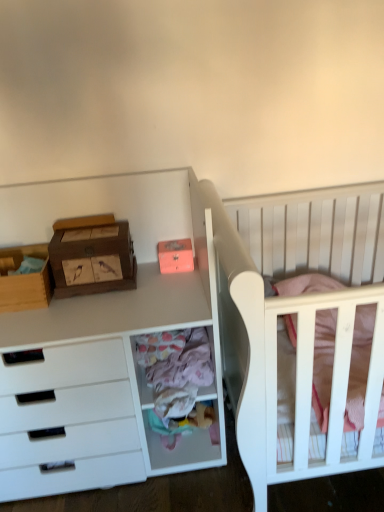
Describe the element at coordinates (103, 342) in the screenshot. I see `wooden chest of drawers at left` at that location.

Image resolution: width=384 pixels, height=512 pixels. What do you see at coordinates (182, 436) in the screenshot? I see `pastel fabric drawer at center` at bounding box center [182, 436].

Find the location of `matte orange storage box at upper center, which appears as the second storage box when viewed from the left`. matte orange storage box at upper center, which appears as the second storage box when viewed from the left is located at coordinates (x=175, y=256).

Identify the location of wooden chest of drawers at left. (103, 342).

From the picture: Is wooden chest of drawers at left shorter than matte orange storage box at upper center, the 1th storage box viewed from the right?

No.

From the image's perspective, is wooden chest of drawers at left beneath matte orange storage box at upper center, the 1th storage box viewed from the right?

Yes.

From a real-world perspective, is wooden chest of drawers at left on matte orange storage box at upper center, the 1th storage box viewed from the right?

Actually, wooden chest of drawers at left is physically below matte orange storage box at upper center, the 1th storage box viewed from the right, in the real world.

Considering the sizes of white wood crib at right and wooden storage box at left, acting as the 2th storage box starting from the right, in the image, is white wood crib at right taller or shorter than wooden storage box at left, acting as the 2th storage box starting from the right,?

Clearly, white wood crib at right is taller compared to wooden storage box at left, acting as the 2th storage box starting from the right.

Based on the photo, is white wood crib at right turned away from wooden storage box at left, arranged as the 1th storage box when viewed from the left?

No, white wood crib at right is not facing the opposite direction of wooden storage box at left, arranged as the 1th storage box when viewed from the left.

Consider the image. From the image's perspective, is white wood crib at right above or below wooden storage box at left, acting as the 2th storage box starting from the right?

Clearly, from the image's perspective, white wood crib at right is below wooden storage box at left, acting as the 2th storage box starting from the right.

Is point (3, 277) positioned behind point (128, 366)?

Yes, point (3, 277) is behind point (128, 366).

From the image's perspective, which one is positioned higher, wooden storage box at left, arranged as the 1th storage box when viewed from the left, or wooden chest of drawers at left?

wooden storage box at left, arranged as the 1th storage box when viewed from the left, is shown above in the image.

Choose the correct answer: Is wooden storage box at left, acting as the 2th storage box starting from the right, inside wooden chest of drawers at left or outside it?

wooden storage box at left, acting as the 2th storage box starting from the right, exists entirely within wooden chest of drawers at left.

Does pastel fabric drawer at center have a lesser height compared to wooden with bird designs at left?

In fact, pastel fabric drawer at center may be taller than wooden with bird designs at left.

Choose the correct answer: Is pastel fabric drawer at center inside wooden with bird designs at left or outside it?

The correct answer is: outside.

You are a GUI agent. You are given a task and a screenshot of the screen. Output one action in this format:
    pyautogui.click(x=<x>, y=<y>)
    Task: Click on the shoe box lying on the left of pastel fabric drawer at center
    Image resolution: width=384 pixels, height=512 pixels.
    Given the screenshot: What is the action you would take?
    pyautogui.click(x=92, y=256)

From the image's perspective, is pastel fabric drawer at center on wooden with bird designs at left?

No, from the image's perspective, pastel fabric drawer at center is not above wooden with bird designs at left.

Which is more to the left, matte orange storage box at upper center, which appears as the second storage box when viewed from the left, or wooden storage box at left, arranged as the 1th storage box when viewed from the left?

wooden storage box at left, arranged as the 1th storage box when viewed from the left, is more to the left.

Can you confirm if matte orange storage box at upper center, which appears as the second storage box when viewed from the left, is shorter than wooden storage box at left, acting as the 2th storage box starting from the right?

Correct, matte orange storage box at upper center, which appears as the second storage box when viewed from the left, is not as tall as wooden storage box at left, acting as the 2th storage box starting from the right.

Looking at their sizes, would you say matte orange storage box at upper center, which appears as the second storage box when viewed from the left, is wider or thinner than wooden storage box at left, acting as the 2th storage box starting from the right?

In the image, matte orange storage box at upper center, which appears as the second storage box when viewed from the left, appears to be more narrow than wooden storage box at left, acting as the 2th storage box starting from the right.

Between matte orange storage box at upper center, the 1th storage box viewed from the right, and wooden storage box at left, acting as the 2th storage box starting from the right, which one has larger size?

wooden storage box at left, acting as the 2th storage box starting from the right, is bigger.

Considering the relative sizes of wooden storage box at left, arranged as the 1th storage box when viewed from the left, and matte orange storage box at upper center, which appears as the second storage box when viewed from the left, in the image provided, is wooden storage box at left, arranged as the 1th storage box when viewed from the left, wider than matte orange storage box at upper center, which appears as the second storage box when viewed from the left,?

Indeed, wooden storage box at left, arranged as the 1th storage box when viewed from the left, has a greater width compared to matte orange storage box at upper center, which appears as the second storage box when viewed from the left.

Is wooden storage box at left, arranged as the 1th storage box when viewed from the left, far from matte orange storage box at upper center, which appears as the second storage box when viewed from the left?

They are positioned close to each other.

Can you confirm if wooden storage box at left, arranged as the 1th storage box when viewed from the left, is taller than matte orange storage box at upper center, the 1th storage box viewed from the right?

Indeed, wooden storage box at left, arranged as the 1th storage box when viewed from the left, has a greater height compared to matte orange storage box at upper center, the 1th storage box viewed from the right.

Considering the sizes of objects wooden storage box at left, acting as the 2th storage box starting from the right, and matte orange storage box at upper center, the 1th storage box viewed from the right, in the image provided, who is bigger, wooden storage box at left, acting as the 2th storage box starting from the right, or matte orange storage box at upper center, the 1th storage box viewed from the right,?

Bigger between the two is wooden storage box at left, acting as the 2th storage box starting from the right.

Does matte orange storage box at upper center, the 1th storage box viewed from the right, have a lesser width compared to pastel fabric drawer at center?

Yes.

From a real-world perspective, is matte orange storage box at upper center, which appears as the second storage box when viewed from the left, above or below pastel fabric drawer at center?

From a real-world perspective, matte orange storage box at upper center, which appears as the second storage box when viewed from the left, is physically above pastel fabric drawer at center.

Is the position of matte orange storage box at upper center, the 1th storage box viewed from the right, less distant than that of pastel fabric drawer at center?

No, the depth of matte orange storage box at upper center, the 1th storage box viewed from the right, is greater than that of pastel fabric drawer at center.

Identify the location of chest of drawers below the matte orange storage box at upper center, which appears as the second storage box when viewed from the left (from the image's perspective). The width and height of the screenshot is (384, 512). (103, 342).

Which storage box is the 1st one when counting from the back of the white wood crib at right? Please provide its 2D coordinates.

[(24, 280)]

Considering their positions, is white wood crib at right positioned closer to matte orange storage box at upper center, the 1th storage box viewed from the right, than wooden storage box at left, arranged as the 1th storage box when viewed from the left?

wooden storage box at left, arranged as the 1th storage box when viewed from the left, is positioned closer to the anchor matte orange storage box at upper center, the 1th storage box viewed from the right.

Considering their positions, is white wood crib at right positioned closer to matte orange storage box at upper center, which appears as the second storage box when viewed from the left, than pastel fabric drawer at center?

pastel fabric drawer at center is positioned closer to the anchor matte orange storage box at upper center, which appears as the second storage box when viewed from the left.

Looking at the image, which one is located closer to wooden chest of drawers at left, wooden with bird designs at left or matte orange storage box at upper center, which appears as the second storage box when viewed from the left?

wooden with bird designs at left is closer to wooden chest of drawers at left.

Estimate the real-world distances between objects in this image. Which object is further from pastel fabric drawer at center, wooden with bird designs at left or wooden chest of drawers at left?

wooden with bird designs at left lies further to pastel fabric drawer at center than the other object.

From the image, which object appears to be nearer to white wood crib at right, wooden storage box at left, arranged as the 1th storage box when viewed from the left, or matte orange storage box at upper center, the 1th storage box viewed from the right?

matte orange storage box at upper center, the 1th storage box viewed from the right, lies closer to white wood crib at right than the other object.

Based on their spatial positions, is wooden chest of drawers at left or wooden with bird designs at left further from white wood crib at right?

Based on the image, wooden with bird designs at left appears to be further to white wood crib at right.

Which object lies nearer to the anchor point wooden chest of drawers at left, wooden with bird designs at left or wooden storage box at left, acting as the 2th storage box starting from the right?

The object closer to wooden chest of drawers at left is wooden with bird designs at left.

Considering their positions, is white wood crib at right positioned further to pastel fabric drawer at center than wooden with bird designs at left?

The object further to pastel fabric drawer at center is white wood crib at right.

Find the location of a particular element. shoe box between wooden chest of drawers at left and matte orange storage box at upper center, which appears as the second storage box when viewed from the left, along the z-axis is located at coordinates (92, 256).

At what (x,y) coordinates should I click in order to perform the action: click on chest of drawers between wooden with bird designs at left and pastel fabric drawer at center in the up-down direction. Please return your answer as a coordinate pair (x, y). Image resolution: width=384 pixels, height=512 pixels. Looking at the image, I should click on (103, 342).

The image size is (384, 512). I want to click on storage box between wooden with bird designs at left and white wood crib at right, so click(175, 256).

At what (x,y) coordinates should I click in order to perform the action: click on storage box situated between wooden chest of drawers at left and white wood crib at right from left to right. Please return your answer as a coordinate pair (x, y). The image size is (384, 512). Looking at the image, I should click on (175, 256).